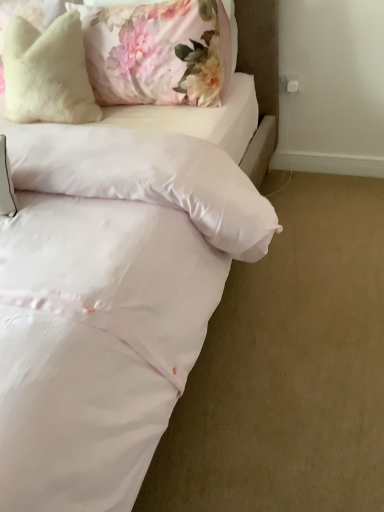
Question: Relative to fluffy white pillow at upper left, the 1th pillow positioned from the right, is fluffy white pillow at upper left, placed as the 2th pillow when sorted from right to left, in front or behind?

Choices:
 (A) behind
 (B) front

Answer: (A)

Question: Looking at the image, does fluffy white pillow at upper left, arranged as the 1th pillow when viewed from the left, seem bigger or smaller compared to fluffy white pillow at upper left, the 1th pillow positioned from the right?

Choices:
 (A) small
 (B) big

Answer: (A)

Question: Considering the real-world distances, which object is farthest from the fluffy white pillow at upper left, arranged as the 1th pillow when viewed from the left?

Choices:
 (A) white satin bed at center
 (B) fluffy white pillow at upper left, the 1th pillow positioned from the right

Answer: (A)

Question: Which is nearer to the fluffy white pillow at upper left, marked as the second pillow in a left-to-right arrangement?

Choices:
 (A) white satin bed at center
 (B) fluffy white pillow at upper left, placed as the 2th pillow when sorted from right to left

Answer: (B)